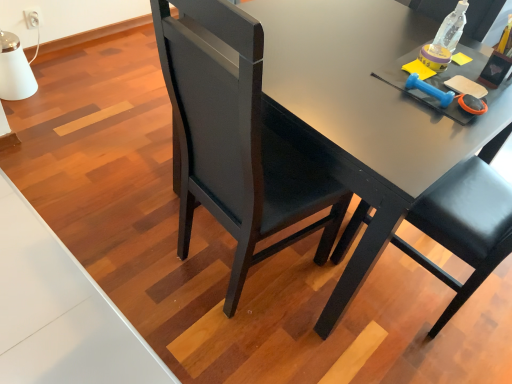
The image size is (512, 384). I want to click on free point to the left of clear plastic bottle at upper right, so click(384, 39).